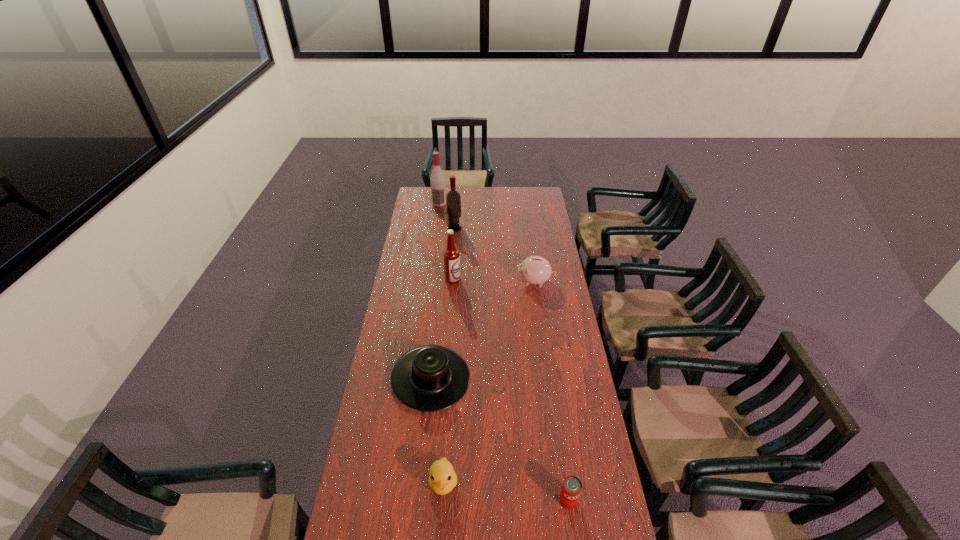
The image size is (960, 540). In order to click on object that is at the far left corner in this screenshot , I will do `click(437, 180)`.

Locate an element on the screen. This screenshot has width=960, height=540. vacant region at the far edge of the desktop is located at coordinates (485, 194).

Where is `free space at the left edge of the desktop`? This screenshot has height=540, width=960. free space at the left edge of the desktop is located at coordinates pyautogui.click(x=427, y=264).

Find the location of a particular element. The width and height of the screenshot is (960, 540). vacant space at the right edge of the desktop is located at coordinates (558, 294).

At what (x,y) coordinates should I click in order to perform the action: click on free location at the far left corner. Please return your answer as a coordinate pair (x, y). Looking at the image, I should click on (420, 201).

At what (x,y) coordinates should I click in order to perform the action: click on vacant region at the far right corner of the desktop. Please return your answer as a coordinate pair (x, y). The image size is (960, 540). Looking at the image, I should click on (522, 192).

At what (x,y) coordinates should I click in order to perform the action: click on free space between the duck and the can. Please return your answer as a coordinate pair (x, y). Looking at the image, I should click on (506, 491).

The width and height of the screenshot is (960, 540). What are the coordinates of `vacant region between the farthest alcohol and the sixth nearest object` in the screenshot? It's located at (447, 215).

At what (x,y) coordinates should I click in order to perform the action: click on empty space between the can and the nearest alcohol. Please return your answer as a coordinate pair (x, y). The image size is (960, 540). Looking at the image, I should click on (x=511, y=390).

The image size is (960, 540). In order to click on free space between the duck and the third nearest object in this screenshot , I will do `click(437, 430)`.